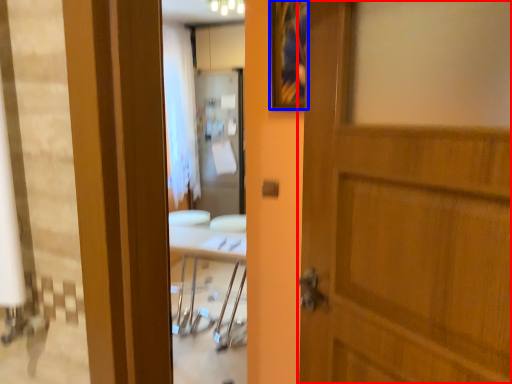
Question: Which of the following is the farthest to the observer, door (highlighted by a red box) or picture frame (highlighted by a blue box)?

Choices:
 (A) door
 (B) picture frame

Answer: (B)